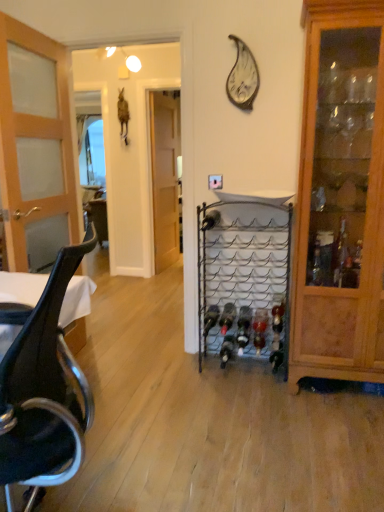
Identify the location of free location to the right of black glass wine bottle at center, which appears as the 2th wine bottle when viewed from the left. The width and height of the screenshot is (384, 512). (255, 371).